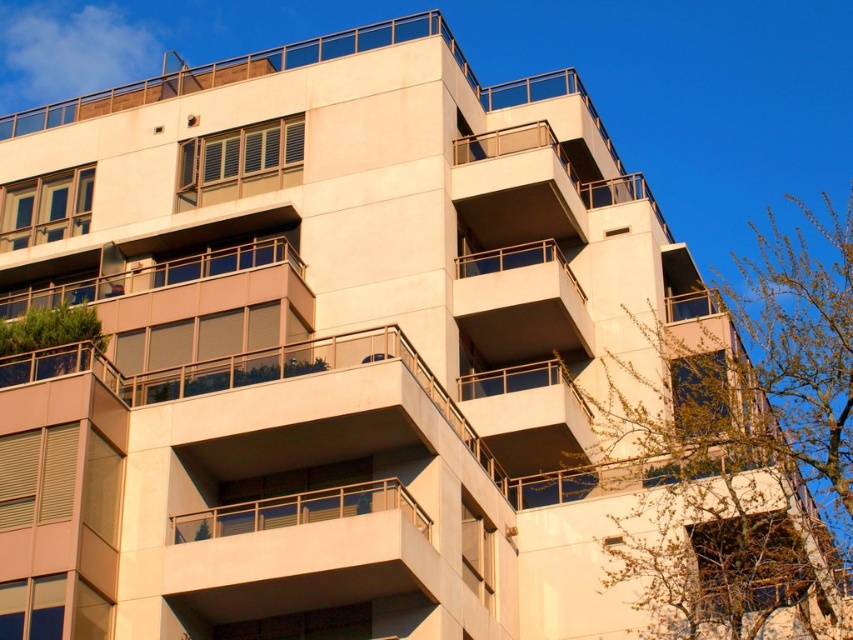
Question: Does green leafy tree at upper right have a smaller size compared to green leafy tree at lower left?

Choices:
 (A) no
 (B) yes

Answer: (A)

Question: Does green leafy tree at upper right have a larger size compared to green leafy tree at lower left?

Choices:
 (A) no
 (B) yes

Answer: (B)

Question: Does green leafy tree at upper right appear on the left side of green leafy tree at lower left?

Choices:
 (A) no
 (B) yes

Answer: (A)

Question: Among these points, which one is farthest from the camera?

Choices:
 (A) tap(10, 369)
 (B) tap(751, 355)

Answer: (B)

Question: Among these points, which one is farthest from the camera?

Choices:
 (A) (810, 314)
 (B) (27, 324)

Answer: (A)